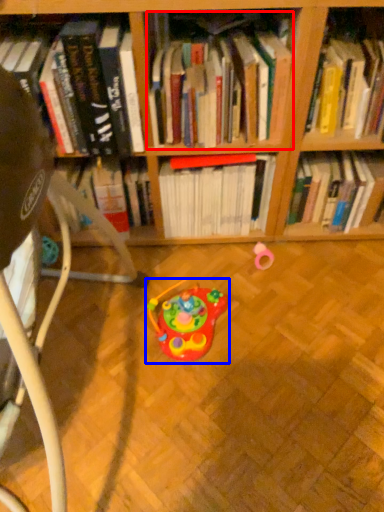
Question: Which object appears closest to the camera in this image, book (highlighted by a red box) or toy (highlighted by a blue box)?

Choices:
 (A) book
 (B) toy

Answer: (A)